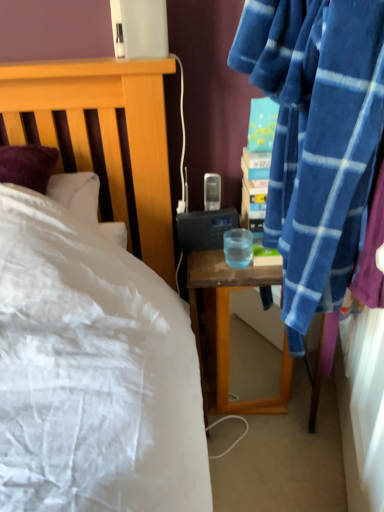
This screenshot has width=384, height=512. What are the coordinates of `transparent plastic cup at bedside table` in the screenshot? It's located at (238, 247).

Measure the distance between transparent plastic cup at bedside table and camera.

The distance of transparent plastic cup at bedside table from camera is 1.09 meters.

The image size is (384, 512). What do you see at coordinates (238, 247) in the screenshot?
I see `transparent plastic cup at bedside table` at bounding box center [238, 247].

What do you see at coordinates (228, 329) in the screenshot? I see `wooden desk at right` at bounding box center [228, 329].

Identify the location of wooden desk at right. This screenshot has height=512, width=384. (228, 329).

What is the approximate height of wooden desk at right?

The height of wooden desk at right is 21.83 inches.

Where is `transparent plastic cup at bedside table`? transparent plastic cup at bedside table is located at coordinates (238, 247).

Looking at this image, considering the relative positions of transparent plastic cup at bedside table and wooden desk at right in the image provided, is transparent plastic cup at bedside table to the left of wooden desk at right from the viewer's perspective?

Correct, you'll find transparent plastic cup at bedside table to the left of wooden desk at right.

Does transparent plastic cup at bedside table come in front of wooden desk at right?

Yes, it is.

Between point (240, 247) and point (192, 274), which one is positioned behind?

The point (240, 247) is behind.

From the image's perspective, is transparent plastic cup at bedside table above wooden desk at right?

Yes.

Consider the image. From a real-world perspective, between transparent plastic cup at bedside table and wooden desk at right, who is vertically higher?

From a 3D spatial view, transparent plastic cup at bedside table is above.

Looking at their sizes, would you say transparent plastic cup at bedside table is wider or thinner than wooden desk at right?

transparent plastic cup at bedside table is thinner than wooden desk at right.

Looking at this image, can you confirm if transparent plastic cup at bedside table is taller than wooden desk at right?

Incorrect, the height of transparent plastic cup at bedside table is not larger of that of wooden desk at right.

Based on the photo, is transparent plastic cup at bedside table bigger or smaller than wooden desk at right?

transparent plastic cup at bedside table is smaller than wooden desk at right.

Does transparent plastic cup at bedside table contain wooden desk at right?

No, transparent plastic cup at bedside table does not contain wooden desk at right.

Is transparent plastic cup at bedside table with wooden desk at right?

transparent plastic cup at bedside table is not next to wooden desk at right, and they're not touching.

Could you tell me if transparent plastic cup at bedside table is turned towards wooden desk at right?

Answer: No, transparent plastic cup at bedside table is not turned towards wooden desk at right.

In the image, there is a wooden desk at right. What are the coordinates of `coffee cup above it (from the image's perspective)` in the screenshot? It's located at pos(238,247).

Is wooden desk at right to the left of transparent plastic cup at bedside table from the viewer's perspective?

In fact, wooden desk at right is to the right of transparent plastic cup at bedside table.

In the image, is wooden desk at right positioned in front of or behind transparent plastic cup at bedside table?

Visually, wooden desk at right is located behind transparent plastic cup at bedside table.

Considering the positions of points (213, 392) and (225, 232), is point (213, 392) closer to camera compared to point (225, 232)?

No, (213, 392) is behind (225, 232).

From the picture: From the image's perspective, is wooden desk at right below transparent plastic cup at bedside table?

Yes.

From a real-world perspective, is wooden desk at right on transparent plastic cup at bedside table?

No, from a real-world perspective, wooden desk at right is not above transparent plastic cup at bedside table.

Is wooden desk at right wider or thinner than transparent plastic cup at bedside table?

wooden desk at right is wider than transparent plastic cup at bedside table.

Is wooden desk at right taller than transparent plastic cup at bedside table?

Yes.

Considering the relative sizes of wooden desk at right and transparent plastic cup at bedside table in the image provided, is wooden desk at right smaller than transparent plastic cup at bedside table?

Actually, wooden desk at right might be larger than transparent plastic cup at bedside table.

Would you say transparent plastic cup at bedside table is part of wooden desk at right's contents?

No.

Is wooden desk at right with transparent plastic cup at bedside table?

No, wooden desk at right is not with transparent plastic cup at bedside table.

Is wooden desk at right turned away from transparent plastic cup at bedside table?

No.

How distant is wooden desk at right from transparent plastic cup at bedside table?

The distance of wooden desk at right from transparent plastic cup at bedside table is 9.70 inches.

The height and width of the screenshot is (512, 384). I want to click on desk on the right side of transparent plastic cup at bedside table, so click(x=228, y=329).

You are a GUI agent. You are given a task and a screenshot of the screen. Output one action in this format:
    pyautogui.click(x=<x>, y=<y>)
    Task: Click on the coffee cup above the wooden desk at right (from the image's perspective)
    The width and height of the screenshot is (384, 512).
    Given the screenshot: What is the action you would take?
    pyautogui.click(x=238, y=247)

Where is `coffee cup located in front of the wooden desk at right`? coffee cup located in front of the wooden desk at right is located at coordinates (238, 247).